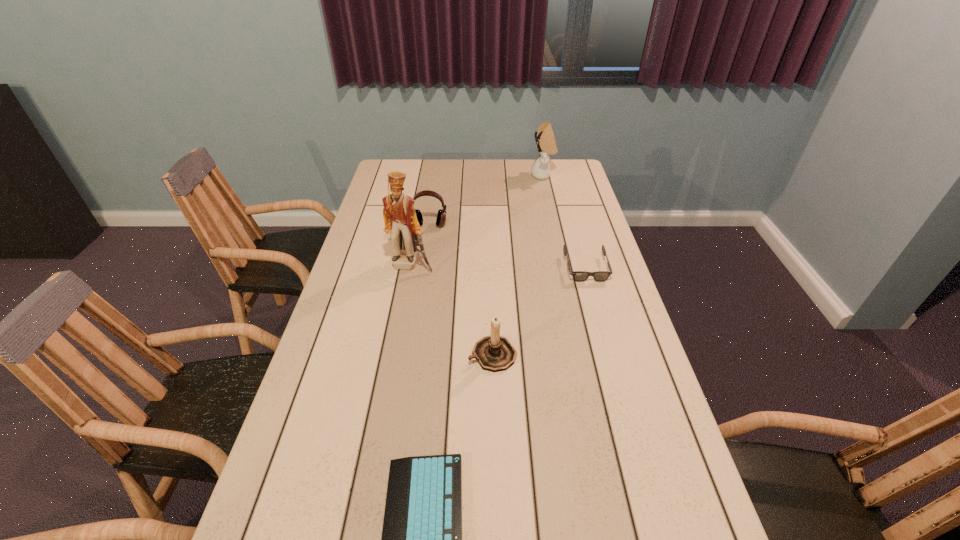
Locate an element on the screen. vacant space situated 0.320m on the back of the candle holder is located at coordinates (491, 264).

Locate an element on the screen. Image resolution: width=960 pixels, height=540 pixels. vacant space located 0.250m on the ear pads of the second farthest object is located at coordinates (422, 275).

The image size is (960, 540). In order to click on vacant position located 0.180m on the temples of the fifth tallest object in this screenshot , I will do pos(602,326).

I want to click on object located at the far edge, so click(x=546, y=144).

I want to click on object that is at the left edge, so click(400, 219).

The height and width of the screenshot is (540, 960). Identify the location of doll at the right edge. (546, 144).

This screenshot has height=540, width=960. In order to click on sunglasses that is at the right edge in this screenshot , I will do `click(579, 276)`.

Find the location of `object at the far right corner`. object at the far right corner is located at coordinates (546, 144).

Where is `vacant space at the far edge of the desktop`? vacant space at the far edge of the desktop is located at coordinates (492, 179).

Find the location of `free space at the left edge of the desktop`. free space at the left edge of the desktop is located at coordinates (303, 463).